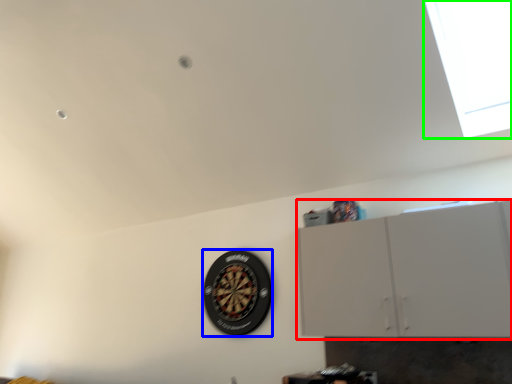
Question: Considering the real-world distances, which object is closest to cabinetry (highlighted by a red box)? wheel (highlighted by a blue box) or window (highlighted by a green box).

Choices:
 (A) wheel
 (B) window

Answer: (B)